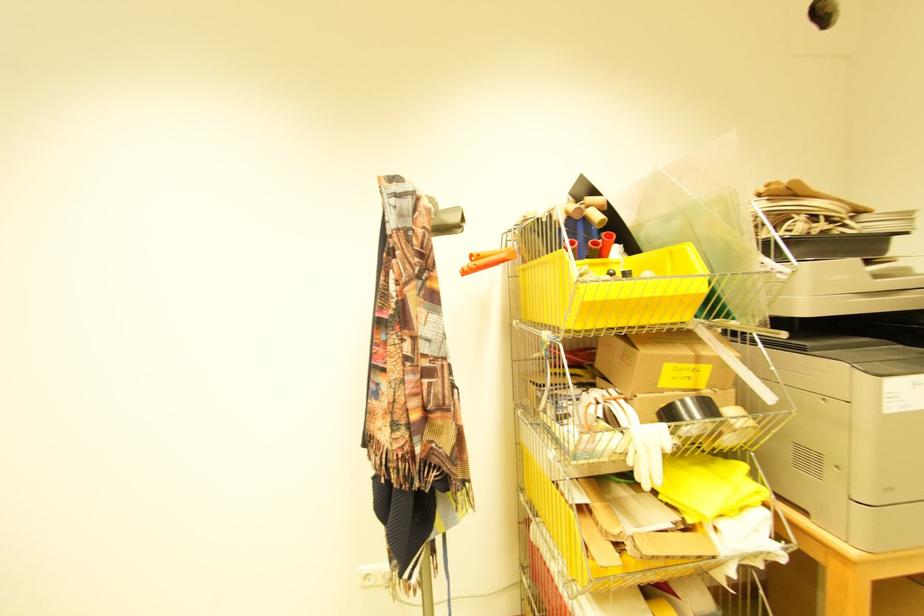
The width and height of the screenshot is (924, 616). Find the location of `orange tool handle`. orange tool handle is located at coordinates (499, 257).